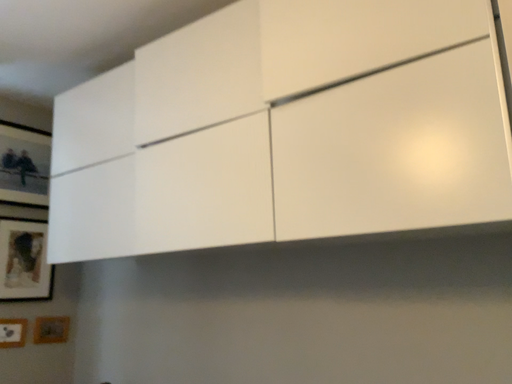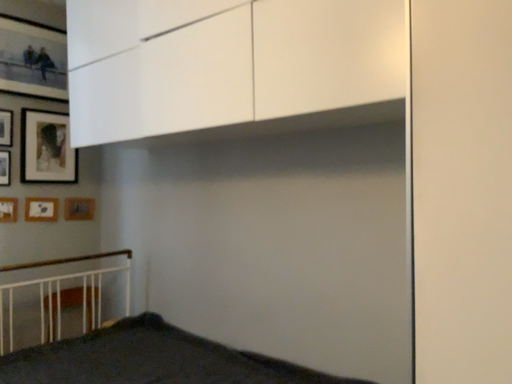
Question: Which way did the camera rotate in the video?

Choices:
 (A) rotated downward
 (B) rotated upward

Answer: (A)